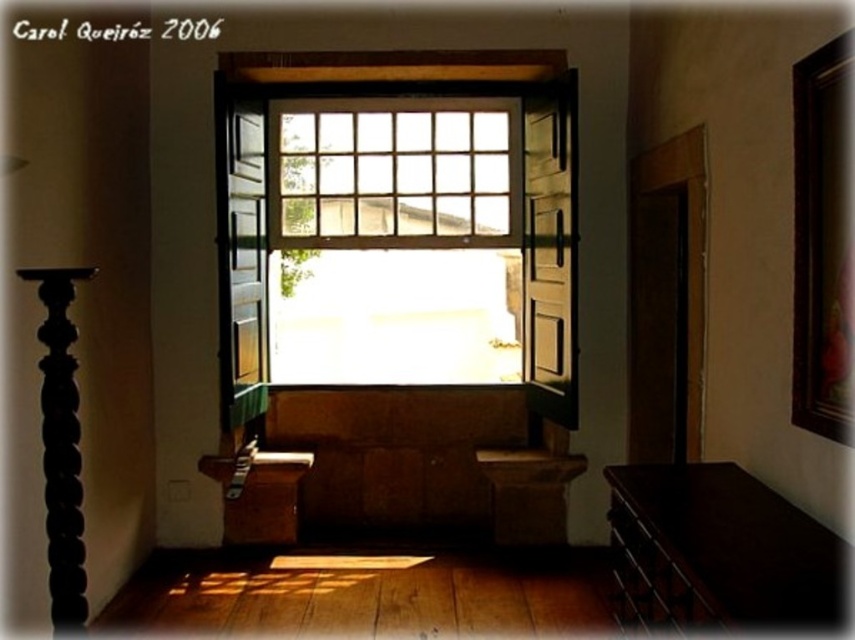
You are standing in the room and want to place a small plant between the two points, point (x=267, y=520) and point (x=653, y=596). Which point is closer to you so you can start placing the plant from there?

Point (x=267, y=520) is closer to you than point (x=653, y=596), so you can start placing the plant from there.

Based on the photo, you are standing in the room depicted in the image. There is a wooden object at point (399, 211). What is the exact location of this wooden object relative to the large window?

The wooden object at point (399, 211) is located at the center of the room, directly below the large window.

In the scene shown: You are standing in the room and want to sit down. There is a wooden at center and a wooden bench at center. Which one can you sit on?

The wooden bench at center is the one you can sit on, as the wooden at center is taller and likely not designed for sitting.